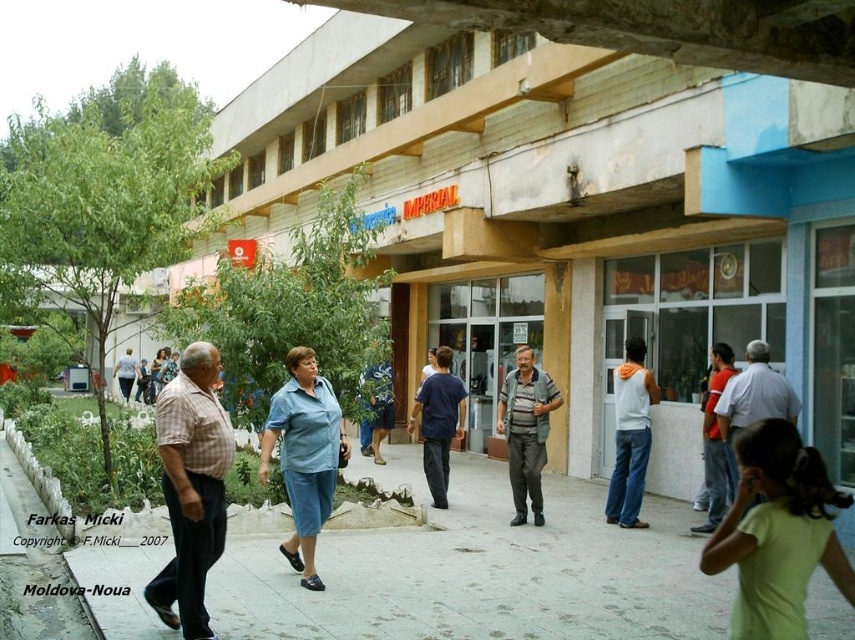
In the scene shown: You are standing at the entrance of the Imperial building and notice two items at the center of the scene. Which one is wider between the gray concrete pavement at center and the blue cotton shirt at center?

The blue cotton shirt at center is wider than the gray concrete pavement at center.